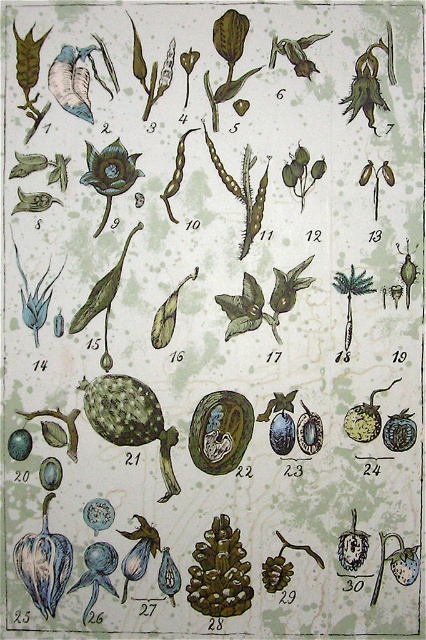
Between brown textured pine cone at center and matte green flower at upper left, which one has more height?

With more height is brown textured pine cone at center.

Which is behind, point (209, 532) or point (103, 173)?

Point (209, 532)

Image resolution: width=426 pixels, height=640 pixels. I want to click on brown textured pine cone at center, so click(x=219, y=572).